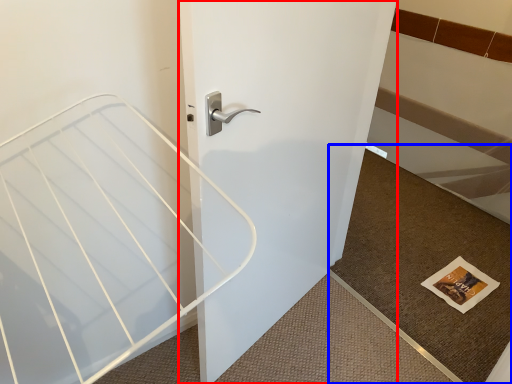
Question: Which object appears farthest to the camera in this image, door (highlighted by a red box) or doormat (highlighted by a blue box)?

Choices:
 (A) door
 (B) doormat

Answer: (B)